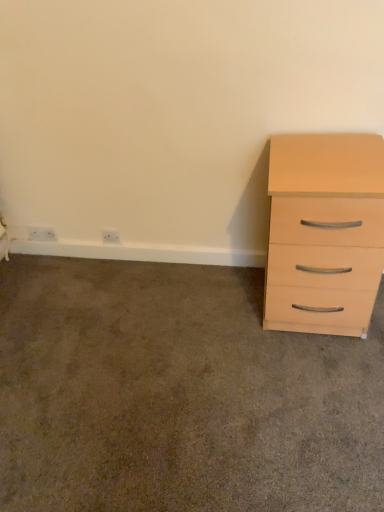
Where is `blank space above beige wood drawer at right (from a real-world perspective)`? This screenshot has height=512, width=384. blank space above beige wood drawer at right (from a real-world perspective) is located at coordinates (147, 360).